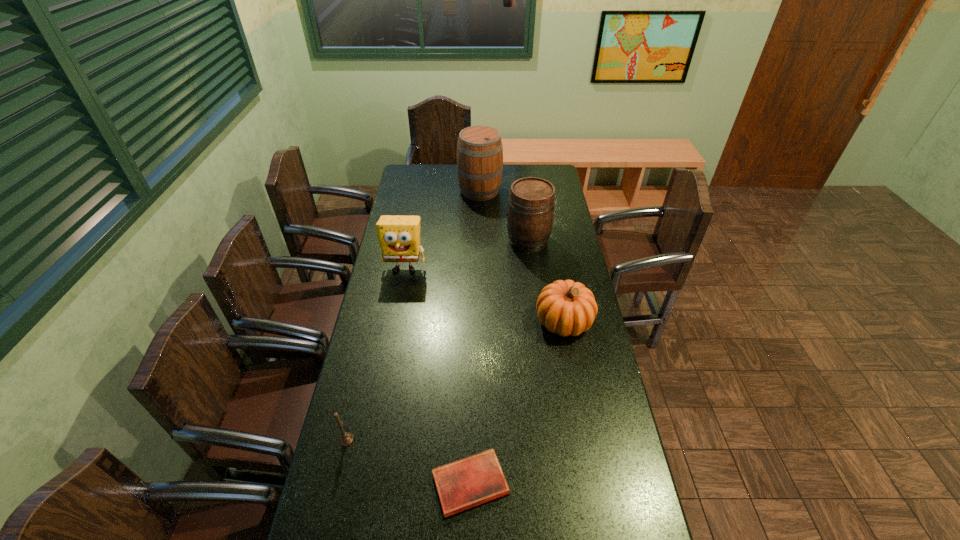
Locate an element on the screen. This screenshot has height=540, width=960. sponge located in the left edge section of the desktop is located at coordinates (399, 236).

Locate an element on the screen. candle that is at the left edge is located at coordinates (346, 438).

You are a GUI agent. You are given a task and a screenshot of the screen. Output one action in this format:
    pyautogui.click(x=<x>, y=<y>)
    Task: Click on the cider that is at the right edge
    Image resolution: width=960 pixels, height=540 pixels.
    Given the screenshot: What is the action you would take?
    pyautogui.click(x=530, y=214)

The width and height of the screenshot is (960, 540). In order to click on pumpkin at the right edge in this screenshot , I will do `click(566, 307)`.

Locate an element on the screen. The width and height of the screenshot is (960, 540). blank space at the left edge is located at coordinates (400, 348).

You are a GUI agent. You are given a task and a screenshot of the screen. Output one action in this format:
    pyautogui.click(x=<x>, y=<y>)
    Task: Click on the free space at the right edge
    The image size is (960, 540).
    Given the screenshot: What is the action you would take?
    pyautogui.click(x=574, y=402)

The image size is (960, 540). In order to click on free space at the far left corner in this screenshot , I will do `click(425, 185)`.

Locate an element on the screen. The width and height of the screenshot is (960, 540). vacant space at the far right corner is located at coordinates (545, 165).

You are a GUI agent. You are given a task and a screenshot of the screen. Output one action in this format:
    pyautogui.click(x=<x>, y=<y>)
    Task: Click on the empty space that is in between the candle and the nearer cider
    
    Given the screenshot: What is the action you would take?
    pyautogui.click(x=437, y=340)

The width and height of the screenshot is (960, 540). I want to click on free spot between the shortest object and the candle, so click(x=408, y=461).